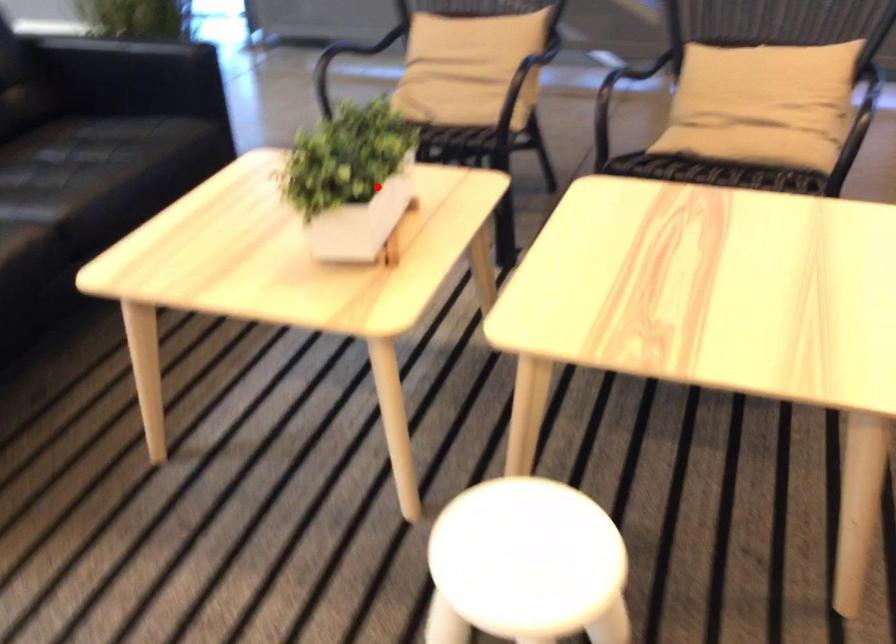
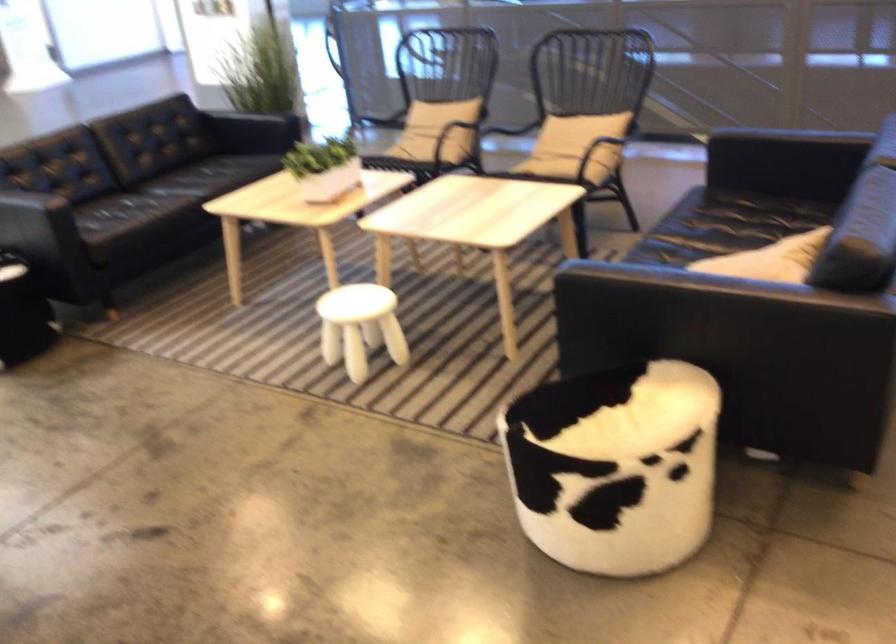
Find the pixel in the second image that matches the highlighted location in the first image.

(323, 167)